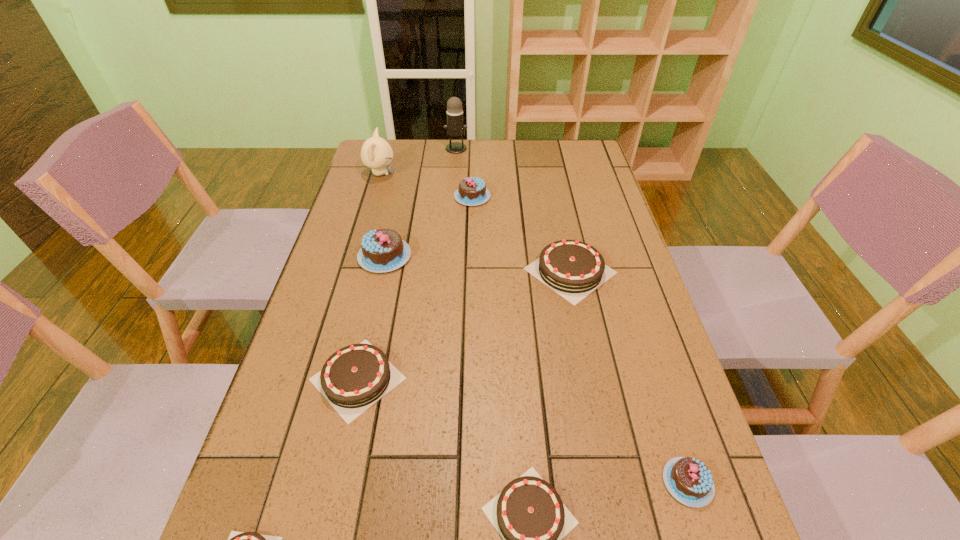
The width and height of the screenshot is (960, 540). What are the coordinates of `the farthest object` in the screenshot? It's located at (455, 128).

You are a GUI agent. You are given a task and a screenshot of the screen. Output one action in this format:
    pyautogui.click(x=<x>, y=<y>)
    Task: Click on the gray microphone
    This screenshot has height=540, width=960.
    Given the screenshot: What is the action you would take?
    pyautogui.click(x=455, y=128)

Identify the location of kitten. (376, 153).

Identify the location of the second tallest object. 376,153.

I want to click on the second nearest pink chocolate cake, so click(x=383, y=250).

The height and width of the screenshot is (540, 960). What are the coordinates of `the tallest chocolate cake` in the screenshot? It's located at (383, 250).

Locate an element on the screen. the third farthest object is located at coordinates (472, 191).

Find the location of a particular element. The height and width of the screenshot is (540, 960). the second pink chocolate cake from right to left is located at coordinates (x=472, y=191).

The width and height of the screenshot is (960, 540). I want to click on the biggest brown chocolate cake, so click(573, 269).

Where is `the fourth nearest chocolate cake`? the fourth nearest chocolate cake is located at coordinates click(355, 377).